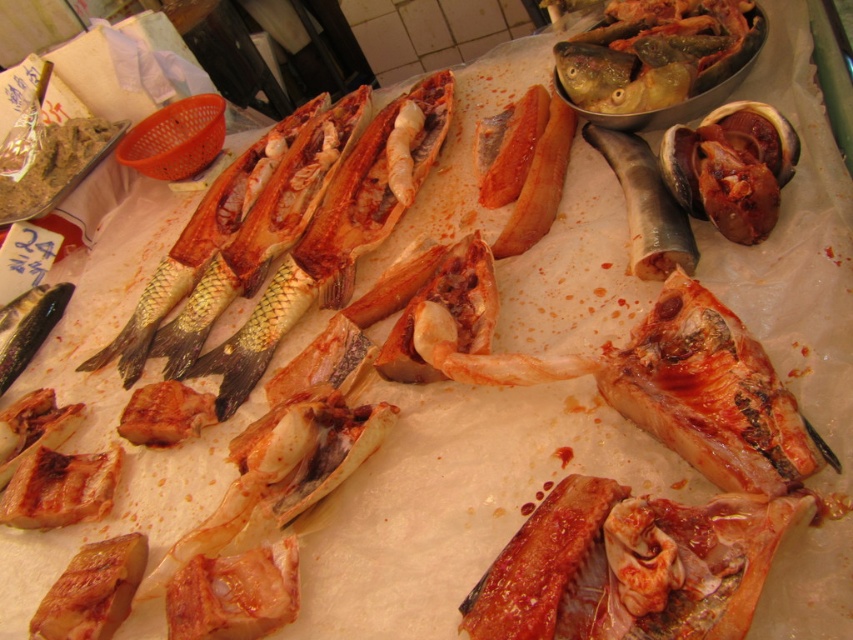
Question: Which of the following is the farthest from the observer?

Choices:
 (A) greenish-brown paste at upper left
 (B) dark purple glossy clam at upper right
 (C) shiny silver fish at upper right
 (D) shiny silver eel at center

Answer: (A)

Question: Observing the image, what is the correct spatial positioning of shiny silver fish at upper right in reference to shiny silver fish at center?

Choices:
 (A) above
 (B) below

Answer: (A)

Question: Does shiny silver fish at center appear on the right side of shiny silver eel at center?

Choices:
 (A) no
 (B) yes

Answer: (A)

Question: Among these objects, which one is nearest to the camera?

Choices:
 (A) shiny silver fish at center
 (B) greenish-brown paste at upper left
 (C) dark purple glossy clam at upper right
 (D) shiny silver eel at center

Answer: (C)

Question: Does shiny silver fish at center have a greater width compared to greenish-brown paste at upper left?

Choices:
 (A) no
 (B) yes

Answer: (B)

Question: Estimate the real-world distances between objects in this image. Which object is closer to the shiny silver eel at center?

Choices:
 (A) greenish-brown paste at upper left
 (B) shiny silver fish at upper right
 (C) shiny silver fish at center
 (D) dark purple glossy clam at upper right

Answer: (D)